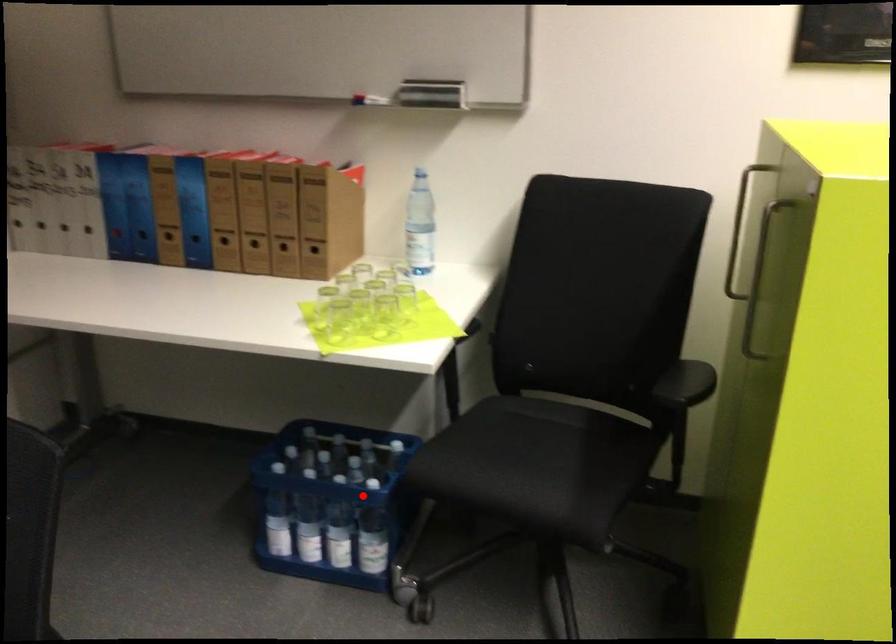
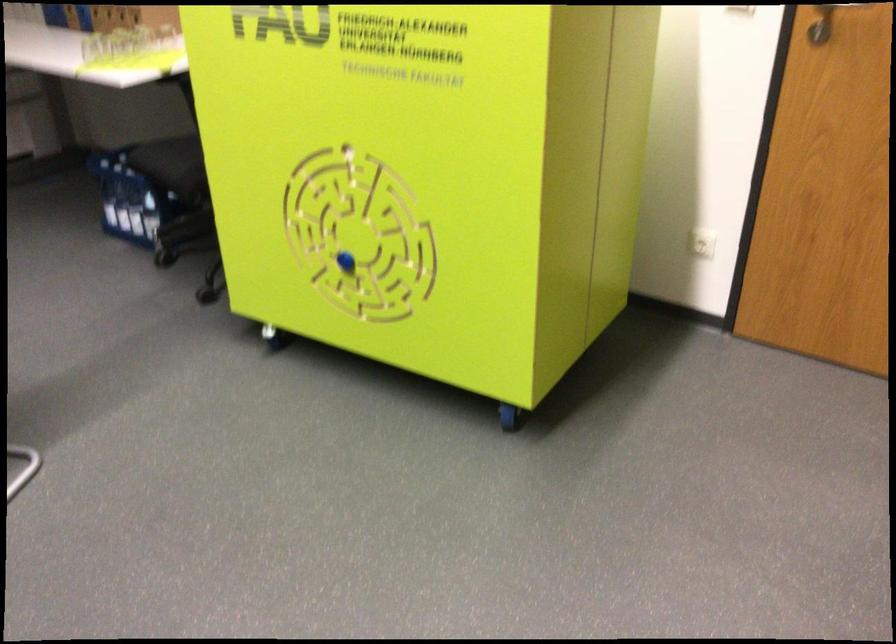
Where in the second image is the point corresponding to the highlighted location from the first image?

(149, 185)